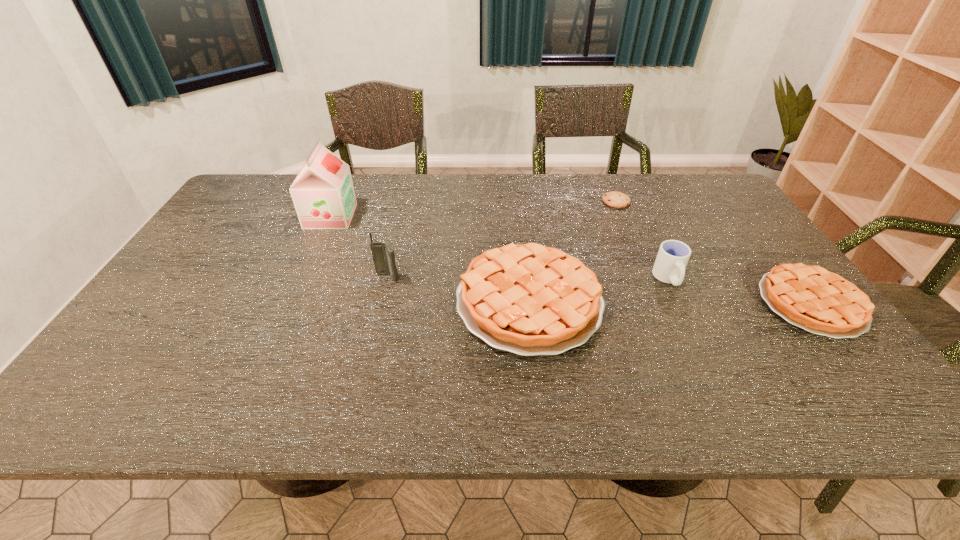
Identify the location of vacant spot to place a pie on the left. (250, 300).